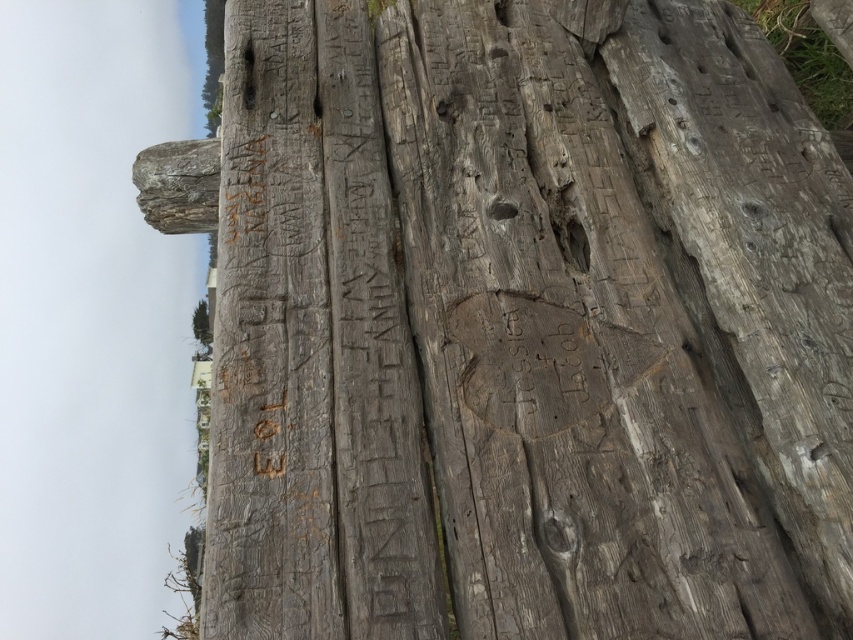
You are an arborist examining the monument and notice the smooth gray tree trunk at upper center and the green leafy tree at upper left. Which of these two trees has a bigger size?

The smooth gray tree trunk at upper center has a larger size compared to the green leafy tree at upper left.